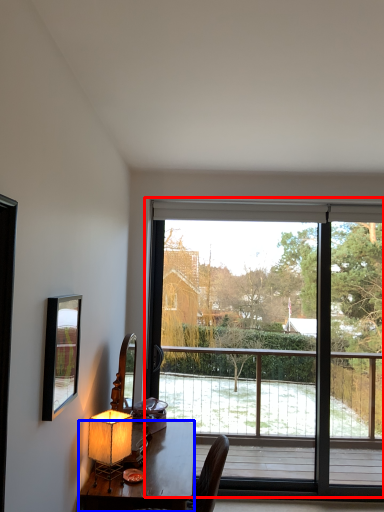
Question: Which object appears farthest to the camera in this image, window (highlighted by a red box) or desk (highlighted by a blue box)?

Choices:
 (A) window
 (B) desk

Answer: (A)